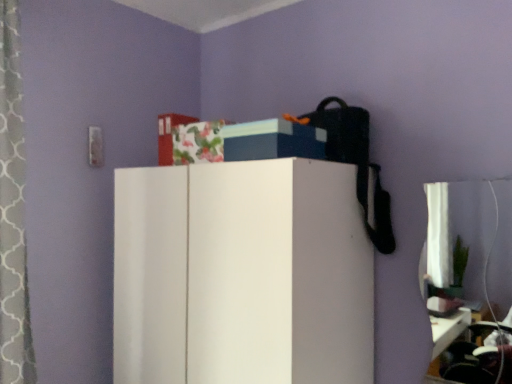
What do you see at coordinates (241, 275) in the screenshot? I see `white matte cabinet at center` at bounding box center [241, 275].

Identify the location of white matte cabinet at center. (241, 275).

What is the approximate height of blue matte storage box at upper center?

It is 5.08 inches.

Locate an element on the screen. This screenshot has height=384, width=512. blue matte storage box at upper center is located at coordinates (272, 140).

The width and height of the screenshot is (512, 384). What do you see at coordinates (272, 140) in the screenshot?
I see `blue matte storage box at upper center` at bounding box center [272, 140].

At what (x,y) coordinates should I click in order to perform the action: click on white matte cabinet at center. Please return your answer as a coordinate pair (x, y). The width and height of the screenshot is (512, 384). Looking at the image, I should click on (241, 275).

Is white matte cabinet at center at the left side of blue matte storage box at upper center?

Correct, you'll find white matte cabinet at center to the left of blue matte storage box at upper center.

Which object is further away from the camera, white matte cabinet at center or blue matte storage box at upper center?

blue matte storage box at upper center is more distant.

Which is closer, (308, 366) or (261, 126)?

The point (308, 366) is closer.

From the image's perspective, is white matte cabinet at center positioned above or below blue matte storage box at upper center?

From the image's perspective, white matte cabinet at center appears below blue matte storage box at upper center.

From a real-world perspective, relative to blue matte storage box at upper center, is white matte cabinet at center vertically above or below?

Clearly, from a real-world perspective, white matte cabinet at center is below blue matte storage box at upper center.

Considering the sizes of white matte cabinet at center and blue matte storage box at upper center in the image, is white matte cabinet at center wider or thinner than blue matte storage box at upper center?

Clearly, white matte cabinet at center has more width compared to blue matte storage box at upper center.

In terms of height, does white matte cabinet at center look taller or shorter compared to blue matte storage box at upper center?

white matte cabinet at center is taller than blue matte storage box at upper center.

Between white matte cabinet at center and blue matte storage box at upper center, which one has smaller size?

blue matte storage box at upper center is smaller.

Would you say white matte cabinet at center contains blue matte storage box at upper center?

No, blue matte storage box at upper center is not surrounded by white matte cabinet at center.

Is white matte cabinet at center far away from blue matte storage box at upper center?

No, there isn't a large distance between white matte cabinet at center and blue matte storage box at upper center.

Is white matte cabinet at center looking in the opposite direction of blue matte storage box at upper center?

No, white matte cabinet at center's orientation is not away from blue matte storage box at upper center.

Locate an element on the screen. This screenshot has width=512, height=384. storage box that is on the right side of white matte cabinet at center is located at coordinates (272, 140).

Considering the positions of objects blue matte storage box at upper center and white matte cabinet at center in the image provided, who is more to the right, blue matte storage box at upper center or white matte cabinet at center?

blue matte storage box at upper center.

Is blue matte storage box at upper center closer to camera compared to white matte cabinet at center?

No, blue matte storage box at upper center is behind white matte cabinet at center.

Which point is more forward, (x=260, y=135) or (x=230, y=285)?

The point (x=260, y=135) is closer to the camera.

From the image's perspective, is blue matte storage box at upper center above or below white matte cabinet at center?

Clearly, from the image's perspective, blue matte storage box at upper center is above white matte cabinet at center.

From a real-world perspective, which object stands above the other?

In real-world perspective, blue matte storage box at upper center is above.

Between blue matte storage box at upper center and white matte cabinet at center, which one has smaller width?

blue matte storage box at upper center is thinner.

Considering the sizes of objects blue matte storage box at upper center and white matte cabinet at center in the image provided, who is taller, blue matte storage box at upper center or white matte cabinet at center?

Standing taller between the two is white matte cabinet at center.

Looking at this image, is blue matte storage box at upper center bigger than white matte cabinet at center?

No.

Would you say blue matte storage box at upper center contains white matte cabinet at center?

No, white matte cabinet at center is not inside blue matte storage box at upper center.

Is blue matte storage box at upper center beside white matte cabinet at center?

No, blue matte storage box at upper center is not making contact with white matte cabinet at center.

Could you tell me if blue matte storage box at upper center is turned towards white matte cabinet at center?

No, blue matte storage box at upper center is not turned towards white matte cabinet at center.

Locate an element on the screen. storage box above the white matte cabinet at center (from a real-world perspective) is located at coordinates (272, 140).

In the image, there is a blue matte storage box at upper center. Identify the location of furniture below it (from a real-world perspective). This screenshot has width=512, height=384. (241, 275).

Where is `storage box on the right of white matte cabinet at center`? The height and width of the screenshot is (384, 512). storage box on the right of white matte cabinet at center is located at coordinates (272, 140).